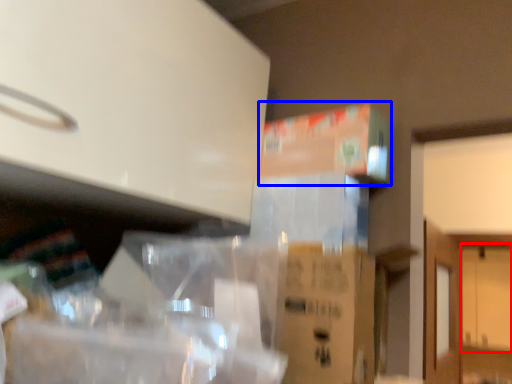
Question: Which object appears farthest to the camera in this image, door (highlighted by a red box) or cardboard box (highlighted by a blue box)?

Choices:
 (A) door
 (B) cardboard box

Answer: (A)